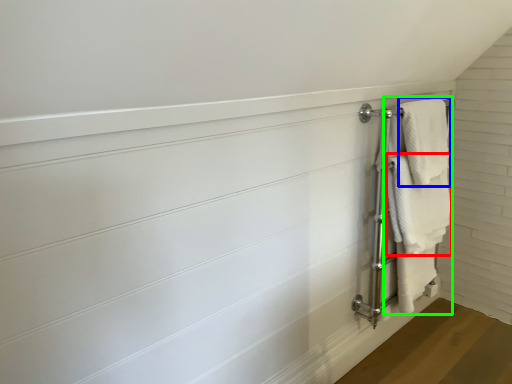
Question: Which object is positioned closest to towel (highlighted by a red box)? Select from bath towel (highlighted by a blue box) and bath towel (highlighted by a green box).

Choices:
 (A) bath towel
 (B) bath towel

Answer: (B)